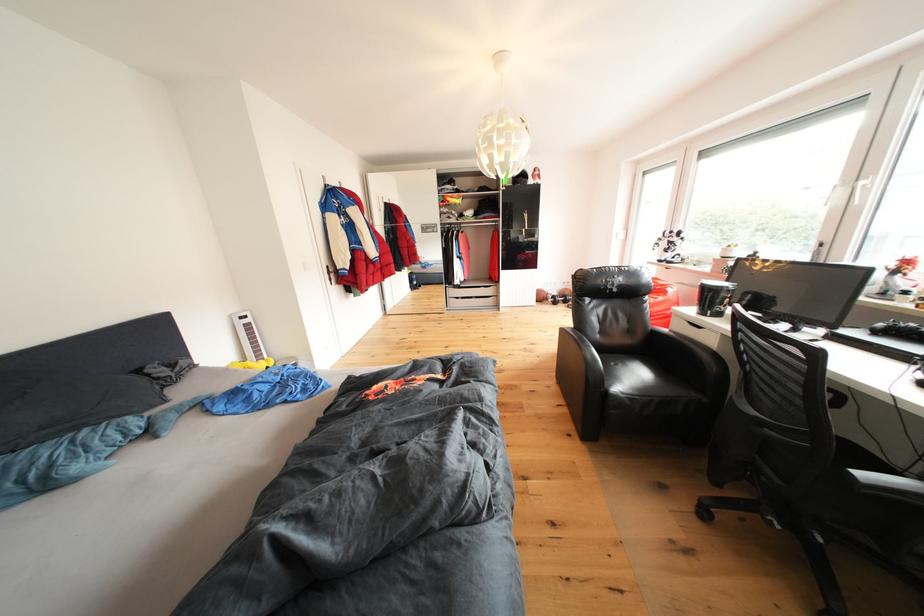
What are the coordinates of `white window handle` in the screenshot? It's located at (859, 188).